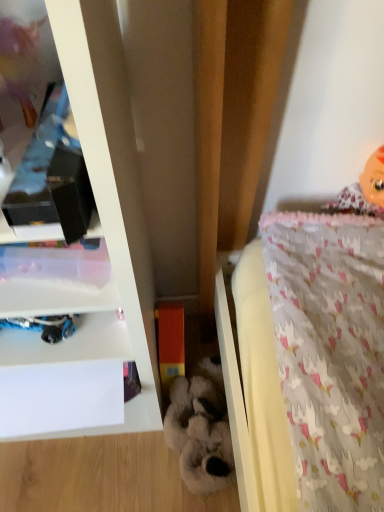
Question: Is pink fabric doll at upper right thinner than orange matte block at center, which appears as the 1th toy when viewed from the left?

Choices:
 (A) yes
 (B) no

Answer: (A)

Question: Is pink fabric doll at upper right further to the viewer compared to orange matte block at center, which appears as the 1th toy when viewed from the left?

Choices:
 (A) yes
 (B) no

Answer: (B)

Question: Considering the relative positions of pink fabric doll at upper right and orange matte block at center, which appears as the 1th toy when viewed from the left, in the image provided, is pink fabric doll at upper right in front of orange matte block at center, which appears as the 1th toy when viewed from the left,?

Choices:
 (A) no
 (B) yes

Answer: (B)

Question: Would you say orange matte block at center, which appears as the 1th toy when viewed from the left, is part of pink fabric doll at upper right's contents?

Choices:
 (A) no
 (B) yes

Answer: (A)

Question: From the image's perspective, does pink fabric doll at upper right appear higher than orange matte block at center, which appears as the 1th toy when viewed from the left?

Choices:
 (A) yes
 (B) no

Answer: (A)

Question: From a real-world perspective, is fluffy white stuffed animal at center, which ranks as the 2th toy in left-to-right order, physically located above or below orange matte block at center, which is the 2th toy from right to left?

Choices:
 (A) above
 (B) below

Answer: (B)

Question: From the image's perspective, is fluffy white stuffed animal at center, which ranks as the 2th toy in left-to-right order, positioned above or below orange matte block at center, which is the 2th toy from right to left?

Choices:
 (A) below
 (B) above

Answer: (A)

Question: Is point (201, 452) closer or farther from the camera than point (160, 305)?

Choices:
 (A) farther
 (B) closer

Answer: (B)

Question: Is fluffy white stuffed animal at center, which ranks as the 2th toy in left-to-right order, situated inside orange matte block at center, which appears as the 1th toy when viewed from the left, or outside?

Choices:
 (A) inside
 (B) outside

Answer: (B)

Question: In the image, is white glossy shelf at upper left positioned in front of or behind pink fabric doll at upper right?

Choices:
 (A) behind
 (B) front

Answer: (B)

Question: Is point (119, 206) positioned closer to the camera than point (342, 192)?

Choices:
 (A) closer
 (B) farther

Answer: (A)

Question: From a real-world perspective, relative to pink fabric doll at upper right, is white glossy shelf at upper left vertically above or below?

Choices:
 (A) above
 (B) below

Answer: (B)

Question: From the image's perspective, relative to pink fabric doll at upper right, is white glossy shelf at upper left above or below?

Choices:
 (A) below
 (B) above

Answer: (A)

Question: From a real-world perspective, is pink fabric doll at upper right above or below orange matte block at center, which is the 2th toy from right to left?

Choices:
 (A) above
 (B) below

Answer: (A)

Question: Is point (360, 201) closer or farther from the camera than point (182, 340)?

Choices:
 (A) farther
 (B) closer

Answer: (B)